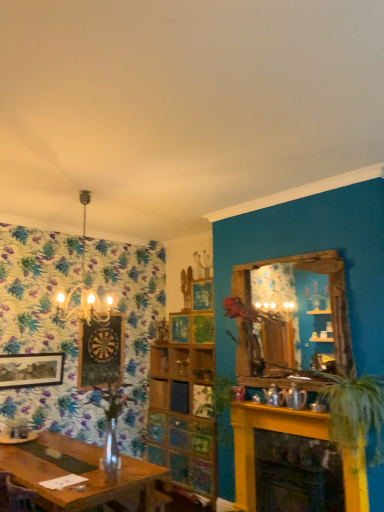
What do you see at coordinates (100, 353) in the screenshot? I see `wooden dartboard at left, which is the 2th picture frame from left to right` at bounding box center [100, 353].

You are a GUI agent. You are given a task and a screenshot of the screen. Output one action in this format:
    pyautogui.click(x=<x>, y=<y>)
    Task: Click on the wooden dartboard at left, which is the 2th picture frame from left to right
    The image size is (384, 512).
    Given the screenshot: What is the action you would take?
    pyautogui.click(x=100, y=353)

Describe the element at coordinates (290, 317) in the screenshot. The height and width of the screenshot is (512, 384). I see `wooden mirror at upper right` at that location.

In order to face matte black picture frame at left, the second picture frame in the right-to-left sequence, should I rotate leftwards or rightwards?

To face it directly, rotate left by 20.706 degrees.

This screenshot has width=384, height=512. Describe the element at coordinates (217, 397) in the screenshot. I see `green leafy plant at center, which ranks as the second plant in right-to-left order` at that location.

In order to face yellow painted brick fireplace at lower right, should I rotate leftwards or rightwards?

A 13.245 degree turn to the right will do.

This screenshot has height=512, width=384. What are the coordinates of `wooden dartboard at left, arranged as the 1th picture frame when viewed from the back` in the screenshot? It's located at (100, 353).

Who is shorter, green leafy plant at right, which is counted as the first plant, starting from the front, or green leafy plant at center, arranged as the 2th plant when viewed from the left?

green leafy plant at center, arranged as the 2th plant when viewed from the left.

Looking at this image, from the image's perspective, does green leafy plant at right, which is counted as the 3th plant, starting from the left, appear higher than green leafy plant at center, the 1th plant from the back?

Correct, green leafy plant at right, which is counted as the 3th plant, starting from the left, appears higher than green leafy plant at center, the 1th plant from the back, in the image.

Does green leafy plant at right, which is counted as the 3th plant, starting from the left, have a larger size compared to green leafy plant at center, the 1th plant from the back?

Correct, green leafy plant at right, which is counted as the 3th plant, starting from the left, is larger in size than green leafy plant at center, the 1th plant from the back.

Locate an element on the screen. The width and height of the screenshot is (384, 512). plant that is the 2nd object above the green leafy plant at right, which is counted as the 3th plant, starting from the left (from a real-world perspective) is located at coordinates (217, 397).

Is wooden mirror at upper right oriented towards green leafy plant at right, which is counted as the 3th plant, starting from the left?

No, wooden mirror at upper right does not turn towards green leafy plant at right, which is counted as the 3th plant, starting from the left.

Considering the points (279, 312) and (335, 409), which point is behind, point (279, 312) or point (335, 409)?

The point (279, 312) is more distant.

Can we say wooden mirror at upper right lies outside green leafy plant at right, which is counted as the first plant, starting from the front?

Yes, wooden mirror at upper right is outside of green leafy plant at right, which is counted as the first plant, starting from the front.

Is wooden mirror at upper right in front of or behind green leafy plant at right, the first plant from the right, in the image?

wooden mirror at upper right is positioned farther from the viewer than green leafy plant at right, the first plant from the right.

Considering the relative sizes of wooden dartboard at left, which is the first picture frame in right-to-left order, and wooden mirror at upper right in the image provided, is wooden dartboard at left, which is the first picture frame in right-to-left order, smaller than wooden mirror at upper right?

Yes, wooden dartboard at left, which is the first picture frame in right-to-left order, is smaller than wooden mirror at upper right.

Find the location of a particular element. Image resolution: width=384 pixels, height=512 pixels. the 1st picture frame positioned below the wooden mirror at upper right (from the image's perspective) is located at coordinates (100, 353).

Is wooden dartboard at left, arranged as the 1th picture frame when viewed from the back, inside the boundaries of wooden mirror at upper right, or outside?

wooden dartboard at left, arranged as the 1th picture frame when viewed from the back, is not enclosed by wooden mirror at upper right.

Does wooden dartboard at left, arranged as the 1th picture frame when viewed from the back, appear on the right side of wooden mirror at upper right?

In fact, wooden dartboard at left, arranged as the 1th picture frame when viewed from the back, is to the left of wooden mirror at upper right.

In the scene shown: Who is taller, green leafy plant at center, arranged as the third plant when viewed from the front, or wooden dartboard at left, arranged as the 1th picture frame when viewed from the back?

Standing taller between the two is wooden dartboard at left, arranged as the 1th picture frame when viewed from the back.

Between point (211, 411) and point (78, 356), which one is positioned behind?

The point (211, 411) is more distant.

From the image's perspective, which object appears higher, green leafy plant at center, the 1th plant from the back, or wooden dartboard at left, arranged as the 1th picture frame when viewed from the back?

wooden dartboard at left, arranged as the 1th picture frame when viewed from the back.

Is green leafy plant at center, which ranks as the second plant in right-to-left order, outside of wooden dartboard at left, which is the 2th picture frame from left to right?

green leafy plant at center, which ranks as the second plant in right-to-left order, lies outside wooden dartboard at left, which is the 2th picture frame from left to right,'s area.

Does green leafy plant at right, which is counted as the first plant, starting from the front, have a smaller size compared to clear glass vase at center, the 3th plant from the right?

Actually, green leafy plant at right, which is counted as the first plant, starting from the front, might be larger than clear glass vase at center, the 3th plant from the right.

From a real-world perspective, is green leafy plant at right, which is counted as the first plant, starting from the front, above or below clear glass vase at center, the 3th plant from the right?

In terms of real-world spatial position, green leafy plant at right, which is counted as the first plant, starting from the front, is below clear glass vase at center, the 3th plant from the right.

Could you tell me if green leafy plant at right, the third plant when ordered from back to front, is facing clear glass vase at center, the 3th plant from the right?

No, green leafy plant at right, the third plant when ordered from back to front, does not turn towards clear glass vase at center, the 3th plant from the right.

Based on the photo, how different are the orientations of green leafy plant at right, the third plant when ordered from back to front, and clear glass vase at center, which is the second plant in back-to-front order, in degrees?

The angular difference between green leafy plant at right, the third plant when ordered from back to front, and clear glass vase at center, which is the second plant in back-to-front order, is 91.8 degrees.

Considering the positions of objects wooden dartboard at left, which is the first picture frame in right-to-left order, and yellow painted brick fireplace at lower right in the image provided, who is more to the right, wooden dartboard at left, which is the first picture frame in right-to-left order, or yellow painted brick fireplace at lower right?

yellow painted brick fireplace at lower right is more to the right.

From a real-world perspective, is wooden dartboard at left, which is the first picture frame in right-to-left order, under yellow painted brick fireplace at lower right?

No, from a real-world perspective, wooden dartboard at left, which is the first picture frame in right-to-left order, is not below yellow painted brick fireplace at lower right.

Is wooden dartboard at left, which ranks as the 2th picture frame in front-to-back order, aimed at yellow painted brick fireplace at lower right?

Yes, wooden dartboard at left, which ranks as the 2th picture frame in front-to-back order, is facing yellow painted brick fireplace at lower right.

Does point (98, 342) come behind point (344, 476)?

Yes, point (98, 342) is farther from viewer.

Is yellow painted brick fireplace at lower right situated inside clear glass vase at center, which is the second plant in back-to-front order, or outside?

yellow painted brick fireplace at lower right is not enclosed by clear glass vase at center, which is the second plant in back-to-front order.

Is yellow painted brick fireplace at lower right facing towards clear glass vase at center, which is the second plant in back-to-front order?

Yes, yellow painted brick fireplace at lower right is oriented towards clear glass vase at center, which is the second plant in back-to-front order.

Is yellow painted brick fireplace at lower right bigger than clear glass vase at center, which appears as the second plant when viewed from the front?

Yes.

In terms of height, does yellow painted brick fireplace at lower right look taller or shorter compared to clear glass vase at center, the first plant viewed from the left?

In the image, yellow painted brick fireplace at lower right appears to be taller than clear glass vase at center, the first plant viewed from the left.

Identify the location of plant that is the 2nd object directly below the green leafy plant at center, arranged as the third plant when viewed from the front (from a real-world perspective). (355, 410).

At what (x,y) coordinates should I click in order to perform the action: click on window located above the green leafy plant at right, the third plant when ordered from back to front (from a real-world perspective). Please return your answer as a coordinate pair (x, y). Image resolution: width=384 pixels, height=512 pixels. Looking at the image, I should click on (290, 317).

From the picture: Based on their spatial positions, is green leafy plant at center, the 1th plant from the back, or yellow painted brick fireplace at lower right further from green leafy plant at right, which is counted as the first plant, starting from the front?

green leafy plant at center, the 1th plant from the back, is further to green leafy plant at right, which is counted as the first plant, starting from the front.

Which object lies nearer to the anchor point gold metallic chandelier at upper left, green leafy plant at right, which is counted as the first plant, starting from the front, or yellow painted brick fireplace at lower right?

yellow painted brick fireplace at lower right is positioned closer to the anchor gold metallic chandelier at upper left.

Looking at the image, which one is located further to clear glass vase at center, which appears as the second plant when viewed from the front, gold metallic chandelier at upper left or green leafy plant at center, arranged as the third plant when viewed from the front?

Based on the image, green leafy plant at center, arranged as the third plant when viewed from the front, appears to be further to clear glass vase at center, which appears as the second plant when viewed from the front.

Based on their spatial positions, is matte black picture frame at left, the second picture frame in the right-to-left sequence, or wooden mirror at upper right further from yellow painted brick fireplace at lower right?

Among the two, matte black picture frame at left, the second picture frame in the right-to-left sequence, is located further to yellow painted brick fireplace at lower right.

Looking at the image, which one is located further to green leafy plant at right, which is counted as the 3th plant, starting from the left, matte black picture frame at left, the first picture frame viewed from the front, or green leafy plant at center, arranged as the third plant when viewed from the front?

Based on the image, matte black picture frame at left, the first picture frame viewed from the front, appears to be further to green leafy plant at right, which is counted as the 3th plant, starting from the left.

Looking at the image, which one is located closer to yellow painted brick fireplace at lower right, wooden dartboard at left, which is the 2th picture frame from left to right, or gold metallic chandelier at upper left?

Based on the image, wooden dartboard at left, which is the 2th picture frame from left to right, appears to be nearer to yellow painted brick fireplace at lower right.

Looking at the image, which one is located further to wooden dartboard at left, which is the first picture frame in right-to-left order, gold metallic chandelier at upper left or green leafy plant at center, the 1th plant from the back?

green leafy plant at center, the 1th plant from the back, lies further to wooden dartboard at left, which is the first picture frame in right-to-left order, than the other object.

Based on their spatial positions, is wooden mirror at upper right or wooden dartboard at left, which is the 2th picture frame from left to right, closer to matte black picture frame at left, acting as the 2th picture frame starting from the back?

Among the two, wooden dartboard at left, which is the 2th picture frame from left to right, is located nearer to matte black picture frame at left, acting as the 2th picture frame starting from the back.

Locate an element on the screen. The height and width of the screenshot is (512, 384). fireplace located between gold metallic chandelier at upper left and green leafy plant at right, the third plant when ordered from back to front, in the left-right direction is located at coordinates (267, 429).

Where is `picture frame between matte black picture frame at left, positioned as the first picture frame in left-to-right order, and green leafy plant at right, which is counted as the first plant, starting from the front, in the horizontal direction`? picture frame between matte black picture frame at left, positioned as the first picture frame in left-to-right order, and green leafy plant at right, which is counted as the first plant, starting from the front, in the horizontal direction is located at coordinates (100, 353).

Where is `plant positioned between gold metallic chandelier at upper left and wooden dartboard at left, arranged as the 1th picture frame when viewed from the back, from near to far`? The image size is (384, 512). plant positioned between gold metallic chandelier at upper left and wooden dartboard at left, arranged as the 1th picture frame when viewed from the back, from near to far is located at coordinates (217, 397).

Where is `picture frame located between matte black picture frame at left, the second picture frame in the right-to-left sequence, and green leafy plant at center, arranged as the third plant when viewed from the front, in the left-right direction`? The width and height of the screenshot is (384, 512). picture frame located between matte black picture frame at left, the second picture frame in the right-to-left sequence, and green leafy plant at center, arranged as the third plant when viewed from the front, in the left-right direction is located at coordinates click(x=100, y=353).